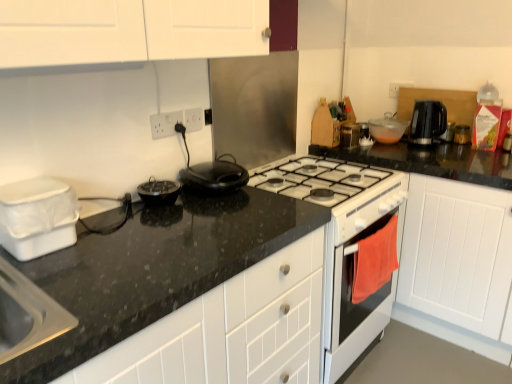
Locate an element on the screen. white plastic electric outlet at upper center, which is the 1th electric outlet from left to right is located at coordinates (165, 124).

The width and height of the screenshot is (512, 384). In order to click on black plastic kettle at upper right, arranged as the 2th appliance when viewed from the front in this screenshot , I will do `click(448, 132)`.

How much space does black plastic kettle at upper right, arranged as the 2th appliance when viewed from the front, occupy vertically?

It is 4.25 inches.

What are the coordinates of `black granite countertop at center` in the screenshot? It's located at (230, 330).

Identify the location of electric outlet located on the left of black granite countertop at center. This screenshot has width=512, height=384. (165, 124).

Which is correct: white plastic electric outlet at upper center, which is the 1th electric outlet from left to right, is inside black granite countertop at center, or outside of it?

white plastic electric outlet at upper center, which is the 1th electric outlet from left to right, is not inside black granite countertop at center, it's outside.

Is point (173, 115) farther from camera compared to point (199, 369)?

Yes, point (173, 115) is behind point (199, 369).

Which object is positioned more to the left, black granite countertop at center or black plastic kettle at upper right, arranged as the 2th appliance when viewed from the front?

black granite countertop at center is more to the left.

From the black granite countertop at center, count 2nd appliance to the right and point to it. Please provide its 2D coordinates.

[(448, 132)]

Is black granite countertop at center far away from black plastic kettle at upper right, acting as the 1th appliance starting from the right?

Yes, black granite countertop at center and black plastic kettle at upper right, acting as the 1th appliance starting from the right, are located far from each other.

Is metallic silver spice rack at upper right, marked as the 4th kitchen appliance in a left-to-right arrangement, not close to white plastic electric outlet at upper center, the 2th electric outlet in the left-to-right sequence?

Actually, metallic silver spice rack at upper right, marked as the 4th kitchen appliance in a left-to-right arrangement, and white plastic electric outlet at upper center, the 2th electric outlet in the left-to-right sequence, are a little close together.

Is white plastic electric outlet at upper center, placed as the first electric outlet when sorted from right to left, inside metallic silver spice rack at upper right, marked as the 3th kitchen appliance in a back-to-front arrangement?

No, white plastic electric outlet at upper center, placed as the first electric outlet when sorted from right to left, is not inside metallic silver spice rack at upper right, marked as the 3th kitchen appliance in a back-to-front arrangement.

Considering the positions of objects metallic silver spice rack at upper right, which ranks as the 5th kitchen appliance in front-to-back order, and white plastic electric outlet at upper center, placed as the first electric outlet when sorted from right to left, in the image provided, who is more to the left, metallic silver spice rack at upper right, which ranks as the 5th kitchen appliance in front-to-back order, or white plastic electric outlet at upper center, placed as the first electric outlet when sorted from right to left,?

From the viewer's perspective, white plastic electric outlet at upper center, placed as the first electric outlet when sorted from right to left, appears more on the left side.

At what (x,y) coordinates should I click in order to perform the action: click on the 3rd kitchen appliance below the white plastic electric outlet at upper center, the 2th electric outlet in the left-to-right sequence (from a real-world perspective). Please return your answer as a coordinate pair (x, y). Image resolution: width=512 pixels, height=384 pixels. Looking at the image, I should click on (350, 135).

From a real-world perspective, is metallic silver toaster at upper right, marked as the 1th kitchen appliance in a back-to-front arrangement, physically located above or below metallic silver spice rack at upper right, which ranks as the 5th kitchen appliance in front-to-back order?

metallic silver toaster at upper right, marked as the 1th kitchen appliance in a back-to-front arrangement, is situated lower than metallic silver spice rack at upper right, which ranks as the 5th kitchen appliance in front-to-back order, in the real world.

Could you tell me if metallic silver toaster at upper right, arranged as the first kitchen appliance when viewed from the right, is facing metallic silver spice rack at upper right, arranged as the 4th kitchen appliance when viewed from the right?

No, metallic silver toaster at upper right, arranged as the first kitchen appliance when viewed from the right, is not aimed at metallic silver spice rack at upper right, arranged as the 4th kitchen appliance when viewed from the right.

Considering the sizes of objects metallic silver toaster at upper right, arranged as the first kitchen appliance when viewed from the right, and metallic silver spice rack at upper right, arranged as the 4th kitchen appliance when viewed from the right, in the image provided, who is thinner, metallic silver toaster at upper right, arranged as the first kitchen appliance when viewed from the right, or metallic silver spice rack at upper right, arranged as the 4th kitchen appliance when viewed from the right,?

With smaller width is metallic silver toaster at upper right, arranged as the first kitchen appliance when viewed from the right.

Between metallic silver toaster at upper right, the 7th kitchen appliance from the front, and metallic silver spice rack at upper right, arranged as the 4th kitchen appliance when viewed from the right, which one has more height?

metallic silver spice rack at upper right, arranged as the 4th kitchen appliance when viewed from the right, is taller.

Based on the photo, from a real-world perspective, is metallic silver spice rack at upper right, marked as the 3th kitchen appliance in a back-to-front arrangement, positioned above or below black granite countertop at center?

metallic silver spice rack at upper right, marked as the 3th kitchen appliance in a back-to-front arrangement, is situated higher than black granite countertop at center in the real world.

Is there a large distance between metallic silver spice rack at upper right, arranged as the 4th kitchen appliance when viewed from the right, and black granite countertop at center?

metallic silver spice rack at upper right, arranged as the 4th kitchen appliance when viewed from the right, is far away from black granite countertop at center.

Is black granite countertop at center surrounded by metallic silver spice rack at upper right, marked as the 3th kitchen appliance in a back-to-front arrangement?

No, black granite countertop at center is not inside metallic silver spice rack at upper right, marked as the 3th kitchen appliance in a back-to-front arrangement.

How many degrees apart are the facing directions of metallic silver spice rack at upper right, marked as the 3th kitchen appliance in a back-to-front arrangement, and black granite countertop at center?

They differ by 90 degrees in their facing directions.

Is black matte waffle maker at center, positioned as the 6th kitchen appliance in back-to-front order, behind black plastic kettle at upper right, which is the second kitchen appliance from right to left?

No, the depth of black matte waffle maker at center, positioned as the 6th kitchen appliance in back-to-front order, is less than that of black plastic kettle at upper right, which is the second kitchen appliance from right to left.

There is a black plastic kettle at upper right, the 4th kitchen appliance from the back. At what (x,y) coordinates should I click in order to perform the action: click on the 5th kitchen appliance below it (from the image's perspective). Please return your answer as a coordinate pair (x, y). Looking at the image, I should click on (159, 192).

From a real-world perspective, which object stands above the other?

black plastic kettle at upper right, the 4th kitchen appliance from the back.

From the image's perspective, does black matte waffle maker at center, which is counted as the 2th kitchen appliance, starting from the left, appear higher than black plastic kettle at upper right, which is the second kitchen appliance from right to left?

No, from the image's perspective, black matte waffle maker at center, which is counted as the 2th kitchen appliance, starting from the left, is not over black plastic kettle at upper right, which is the second kitchen appliance from right to left.

Looking at this image, would you say black matte waffle maker at center, which is counted as the 2th kitchen appliance, starting from the left, is inside or outside black plastic kettle at upper right, acting as the 1th appliance starting from the right?

The correct answer is: outside.

Is black matte waffle maker at center, which is counted as the 2th kitchen appliance, starting from the left, oriented towards black plastic kettle at upper right, the 1th appliance in the back-to-front sequence?

No, black matte waffle maker at center, which is counted as the 2th kitchen appliance, starting from the left, does not turn towards black plastic kettle at upper right, the 1th appliance in the back-to-front sequence.

Can you confirm if black matte waffle maker at center, placed as the sixth kitchen appliance when sorted from right to left, is shorter than black plastic kettle at upper right, which is counted as the 2th appliance, starting from the left?

Yes, black matte waffle maker at center, placed as the sixth kitchen appliance when sorted from right to left, is shorter than black plastic kettle at upper right, which is counted as the 2th appliance, starting from the left.

In order to click on electric outlet lying on the left of black granite countertop at center in this screenshot , I will do `click(165, 124)`.

The width and height of the screenshot is (512, 384). I want to click on appliance that is the 2nd object located above the black granite countertop at center (from the image's perspective), so click(448, 132).

Looking at the image, which one is located closer to black granite countertop at center, translucent glass bowl at upper right, the third kitchen appliance viewed from the right, or black plastic kettle at upper right, the 1th appliance in the back-to-front sequence?

translucent glass bowl at upper right, the third kitchen appliance viewed from the right, is closer to black granite countertop at center.

When comparing their distances from translucent glass bowl at upper right, the third kitchen appliance viewed from the right, does metallic silver spice rack at upper right, which ranks as the 5th kitchen appliance in front-to-back order, or black plastic kettle at upper right, acting as the 1th appliance starting from the right, seem further?

Based on the image, black plastic kettle at upper right, acting as the 1th appliance starting from the right, appears to be further to translucent glass bowl at upper right, the third kitchen appliance viewed from the right.

Considering their positions, is white plastic electric outlet at upper center, which is the 1th electric outlet from left to right, positioned closer to black matte waffle maker at center, acting as the 2th kitchen appliance starting from the front, than black plastic kettle at upper right, acting as the 1th appliance starting from the right?

white plastic electric outlet at upper center, which is the 1th electric outlet from left to right, is closer to black matte waffle maker at center, acting as the 2th kitchen appliance starting from the front.

From the image, which object appears to be nearer to black plastic kettle at upper right, the 2th appliance ordered from the bottom, white plastic electric outlet at upper center, which is the 2th electric outlet from right to left, or black matte waffle maker at center, positioned as the 3th kitchen appliance in left-to-right order?

Based on the image, black matte waffle maker at center, positioned as the 3th kitchen appliance in left-to-right order, appears to be nearer to black plastic kettle at upper right, the 2th appliance ordered from the bottom.

Based on their spatial positions, is white plastic electric outlet at upper center, placed as the first electric outlet when sorted from right to left, or black matte waffle maker at center, positioned as the 3th kitchen appliance in left-to-right order, closer to white plastic container at left, which appears as the first kitchen appliance when viewed from the left?

Based on the image, black matte waffle maker at center, positioned as the 3th kitchen appliance in left-to-right order, appears to be nearer to white plastic container at left, which appears as the first kitchen appliance when viewed from the left.

When comparing their distances from white plastic container at left, placed as the seventh kitchen appliance when sorted from right to left, does metallic silver toaster at upper right, the 7th kitchen appliance from the front, or black granite countertop at center seem closer?

black granite countertop at center is closer to white plastic container at left, placed as the seventh kitchen appliance when sorted from right to left.

Looking at the image, which one is located closer to black plastic kettle at upper right, the 6th kitchen appliance when ordered from left to right, white plastic electric outlet at upper center, placed as the first electric outlet when sorted from right to left, or black granite countertop at center?

Among the two, white plastic electric outlet at upper center, placed as the first electric outlet when sorted from right to left, is located nearer to black plastic kettle at upper right, the 6th kitchen appliance when ordered from left to right.

Considering their positions, is black granite countertop at center positioned closer to white plastic electric outlet at upper center, which is the 1th electric outlet from left to right, than white plastic container at left, the 7th kitchen appliance from the back?

white plastic container at left, the 7th kitchen appliance from the back, is closer to white plastic electric outlet at upper center, which is the 1th electric outlet from left to right.

The image size is (512, 384). I want to click on kitchen appliance between translucent glass bowl at upper right, the third kitchen appliance viewed from the right, and black plastic kettle at upper right, acting as the 1th appliance starting from the right, in the horizontal direction, so click(426, 122).

In order to click on kitchen appliance between white plastic electric outlet at upper center, which is the 1th electric outlet from left to right, and black matte waffle maker at center, acting as the 2th kitchen appliance starting from the front, vertically in this screenshot , I will do `click(214, 176)`.

At what (x,y) coordinates should I click in order to perform the action: click on electric outlet between white plastic electric outlet at upper center, the 2th electric outlet in the left-to-right sequence, and black matte waffle maker at center, acting as the 2th kitchen appliance starting from the front, from top to bottom. Please return your answer as a coordinate pair (x, y). Looking at the image, I should click on (165, 124).

Locate an element on the screen. This screenshot has height=384, width=512. appliance between white plastic container at left, the 7th kitchen appliance from the back, and metallic silver spice rack at upper right, marked as the 4th kitchen appliance in a left-to-right arrangement is located at coordinates point(344,243).